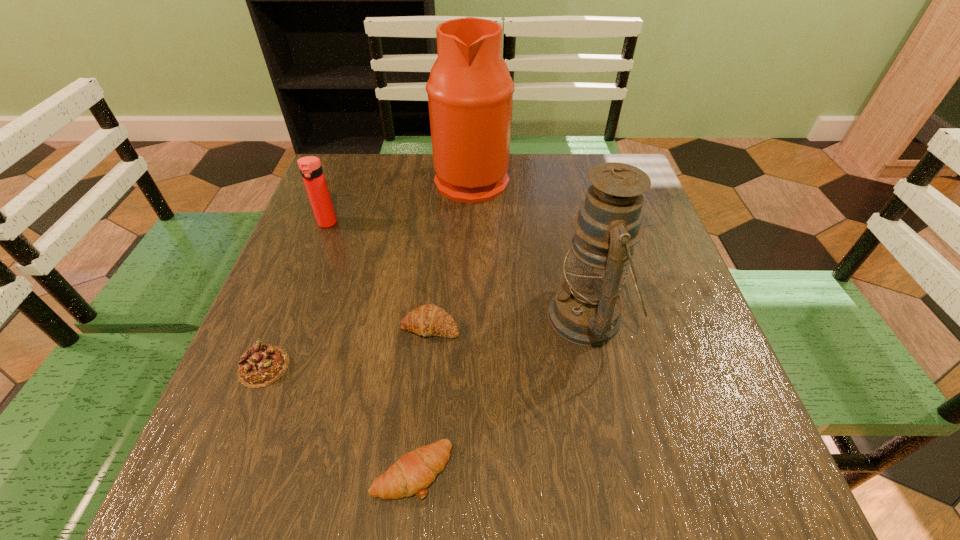
This screenshot has width=960, height=540. Find the location of `free location at the left edge of the desktop`. free location at the left edge of the desktop is located at coordinates (337, 204).

Locate an element on the screen. This screenshot has height=540, width=960. vacant space at the right edge of the desktop is located at coordinates (660, 345).

At what (x,y) coordinates should I click in order to perform the action: click on vacant space at the near left corner. Please return your answer as a coordinate pair (x, y). Image resolution: width=960 pixels, height=540 pixels. Looking at the image, I should click on (236, 483).

Where is `vacant region between the rightmost object and the chocolate cake`? vacant region between the rightmost object and the chocolate cake is located at coordinates (426, 342).

This screenshot has height=540, width=960. Find the location of `vacant space that's between the fifth shortest object and the nearer crescent roll`. vacant space that's between the fifth shortest object and the nearer crescent roll is located at coordinates (500, 394).

Identify the location of unoccupied area between the chocolate cake and the farther crescent roll. The width and height of the screenshot is (960, 540). (348, 346).

This screenshot has width=960, height=540. I want to click on vacant space that is in between the fifth shortest object and the farther crescent roll, so click(x=510, y=321).

Identify the location of vacant point located between the farther crescent roll and the oil lamp. (510, 321).

Where is `blank region between the farther crescent roll and the thermos bottle`? Image resolution: width=960 pixels, height=540 pixels. blank region between the farther crescent roll and the thermos bottle is located at coordinates (379, 275).

Image resolution: width=960 pixels, height=540 pixels. Find the location of `empty location between the rightmost object and the third tallest object`. empty location between the rightmost object and the third tallest object is located at coordinates (458, 270).